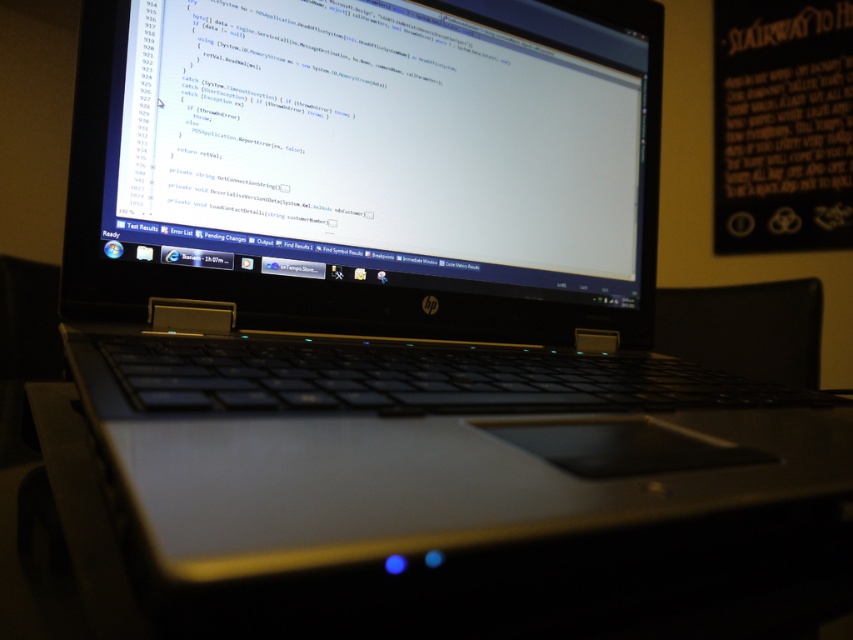
You are organizing a presentation and need to display both the white glossy screen at center and the black matte bulletin board at upper right. Which object should you choose if you want to show the one that takes up more space in the image?

The black matte bulletin board at upper right takes up more space in the image than the white glossy screen at center, so you should choose the black matte bulletin board at upper right.

From the picture: You are a delivery person who needs to place a 6 feet long package on a flat surface. You see the white glossy screen at center and the black matte bulletin board at upper right. Is there enough space between them to place the package?

The distance between the white glossy screen at center and the black matte bulletin board at upper right is 5.82 feet, which is less than the 6 feet length of the package. Therefore, there is not enough space to place the package between them.